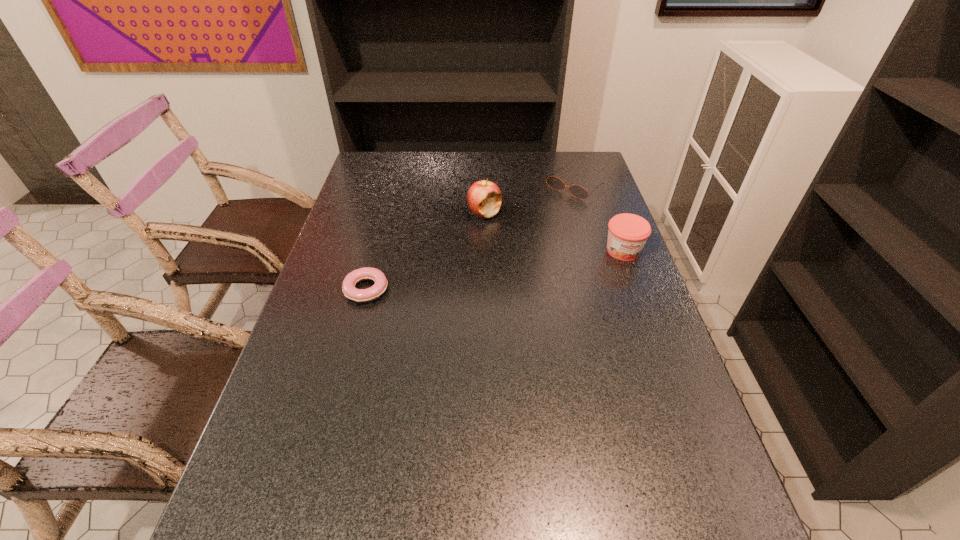
Locate an element on the screen. This screenshot has width=960, height=540. vacant space located 0.260m on the face of the sunglasses is located at coordinates (516, 234).

Find the location of a particular element. free space located on the face of the sunglasses is located at coordinates (523, 228).

Where is `free space located on the face of the sunglasses`? This screenshot has height=540, width=960. free space located on the face of the sunglasses is located at coordinates (538, 217).

You are a GUI agent. You are given a task and a screenshot of the screen. Output one action in this format:
    pyautogui.click(x=<x>, y=<y>)
    Task: Click on the blank space located 0.280m on the bitten side of the second object from left to right
    
    Given the screenshot: What is the action you would take?
    pyautogui.click(x=464, y=282)

At what (x,y) coordinates should I click in order to perform the action: click on free space located 0.220m on the bitten side of the second object from left to right. Please return your answer as a coordinate pair (x, y). The width and height of the screenshot is (960, 540). Looking at the image, I should click on (468, 268).

The height and width of the screenshot is (540, 960). Identify the location of free spot located 0.150m on the bitten side of the second object from left to right. (472, 253).

Where is `object that is at the far edge`? The width and height of the screenshot is (960, 540). object that is at the far edge is located at coordinates (577, 191).

Where is `object located at the left edge`? object located at the left edge is located at coordinates (366, 273).

Locate an element on the screen. jam located in the right edge section of the desktop is located at coordinates (627, 233).

This screenshot has width=960, height=540. Find the location of `sunglasses present at the right edge`. sunglasses present at the right edge is located at coordinates (577, 191).